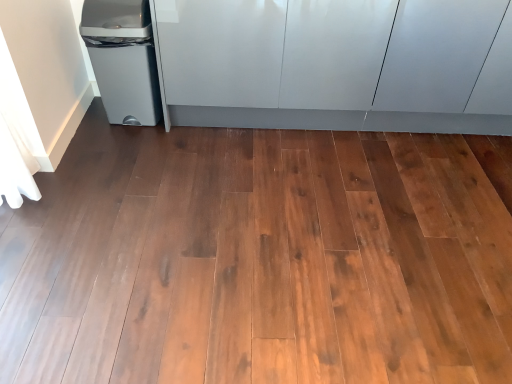
You are a GUI agent. You are given a task and a screenshot of the screen. Output one action in this format:
    pyautogui.click(x=<x>, y=<y>)
    Task: Click on the vacant area located to the right-hand side of matte gray plastic trash can at left
    This screenshot has width=512, height=384.
    Given the screenshot: What is the action you would take?
    pyautogui.click(x=180, y=133)